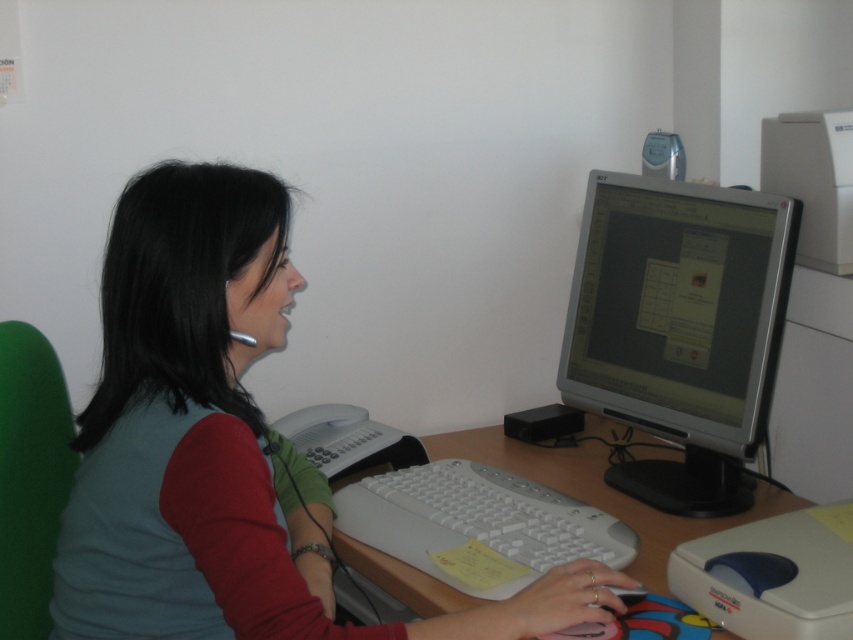
Does matte green shirt at center have a larger size compared to white plastic computer desk at center?

Correct, matte green shirt at center is larger in size than white plastic computer desk at center.

I want to click on matte green shirt at center, so click(221, 445).

Where is `matte green shirt at center`? matte green shirt at center is located at coordinates (221, 445).

Identify the location of matte green shirt at center. The width and height of the screenshot is (853, 640). (221, 445).

Does silver/black plastic monitor at center-right have a larger size compared to white plastic computer desk at center?

Incorrect, silver/black plastic monitor at center-right is not larger than white plastic computer desk at center.

In the scene shown: Is silver/black plastic monitor at center-right positioned in front of white plastic computer desk at center?

No, it is not.

Who is more forward, (727, 284) or (613, 433)?

Point (727, 284) is in front.

The height and width of the screenshot is (640, 853). Find the location of `silver/black plastic monitor at center-right`. silver/black plastic monitor at center-right is located at coordinates (679, 328).

From the picture: Who is shorter, matte green shirt at center or silver/black plastic monitor at center-right?

With less height is silver/black plastic monitor at center-right.

Which is behind, point (596, 616) or point (778, 301)?

Positioned behind is point (778, 301).

I want to click on matte green shirt at center, so click(x=221, y=445).